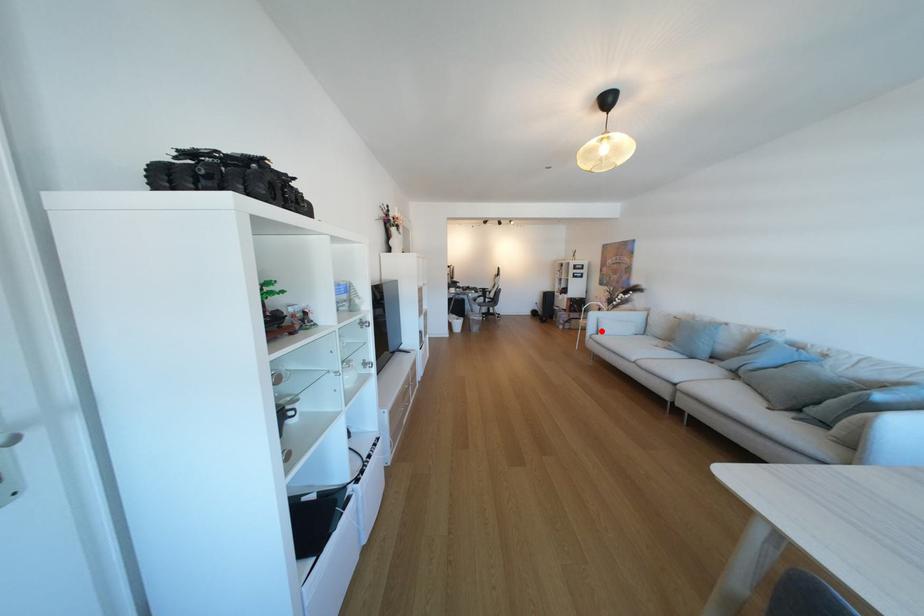
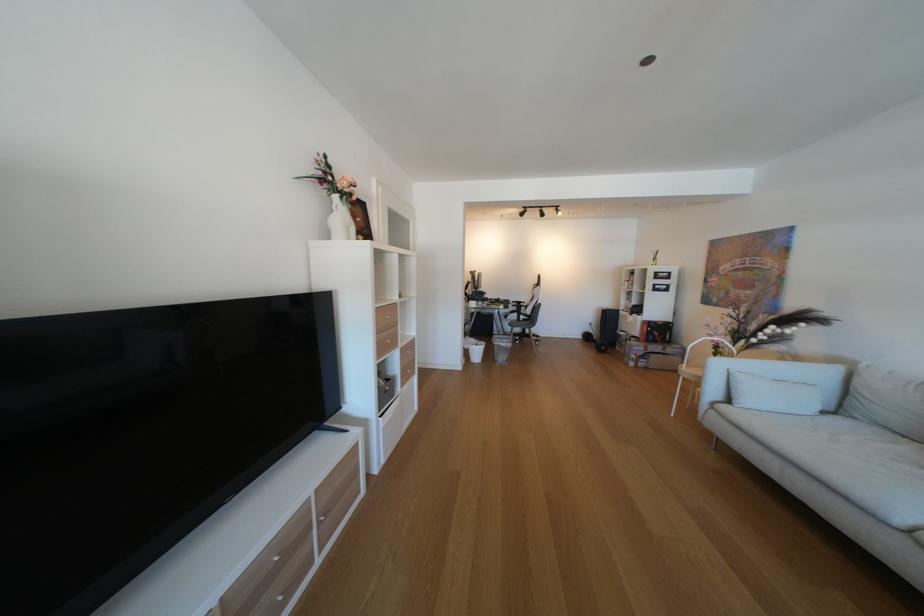
Find the pixel in the second image that matches the highlighted location in the first image.

(723, 392)